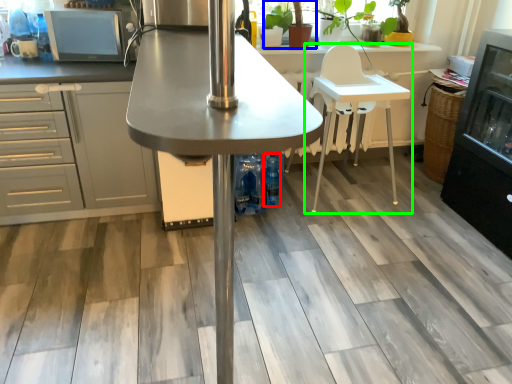
Question: Considering the real-world distances, which object is farthest from bottle (highlighted by a red box)? plant (highlighted by a blue box) or chair (highlighted by a green box)?

Choices:
 (A) plant
 (B) chair

Answer: (A)